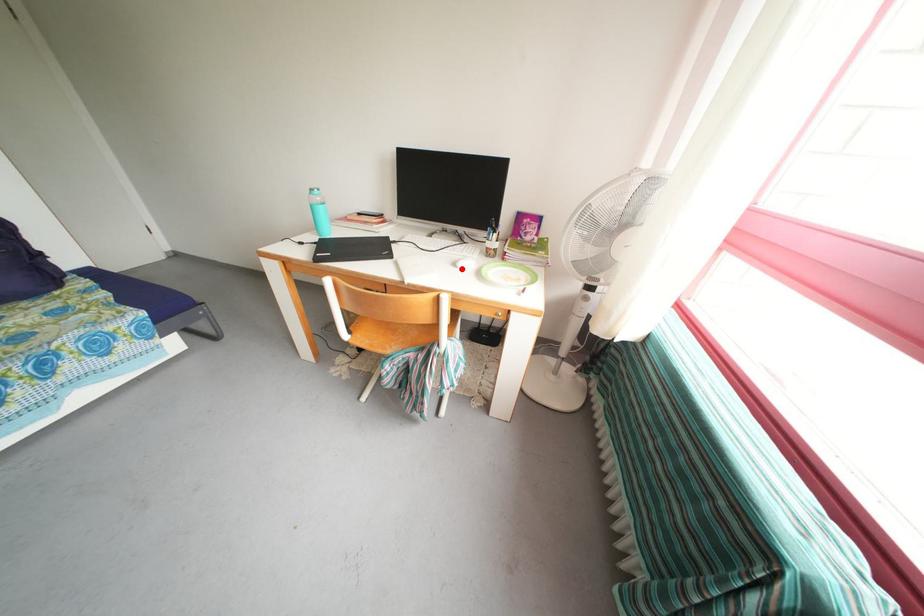
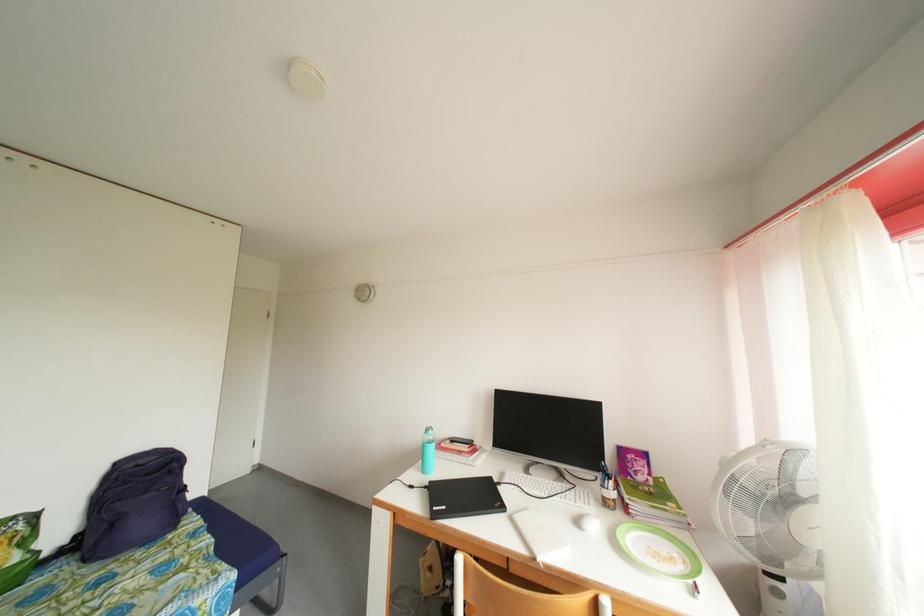
The point at the highlighted location is marked in the first image. Where is the corresponding point in the second image?

(585, 528)